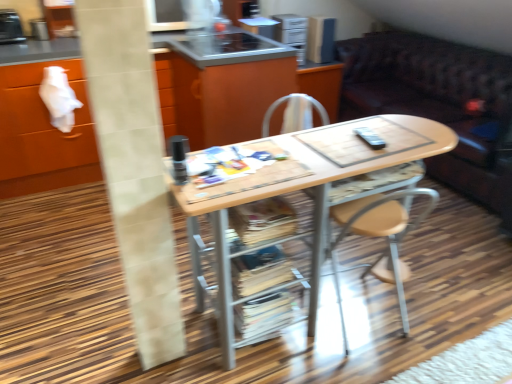
Locate an element on the screen. The width and height of the screenshot is (512, 384). free space to the left of white tile pillar at left is located at coordinates (115, 356).